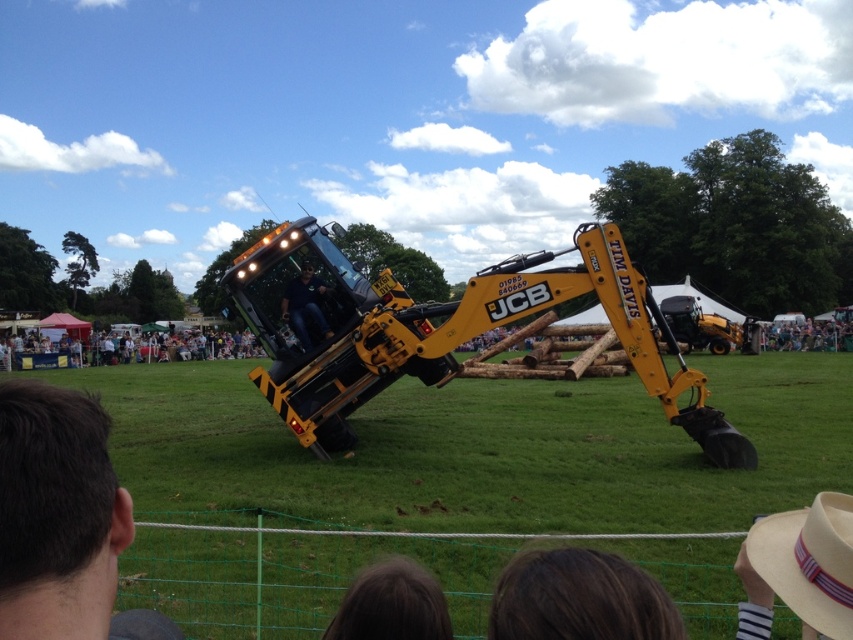
Question: Which point is closer to the camera?

Choices:
 (A) (625, 602)
 (B) (285, 244)
 (C) (817, 448)

Answer: (A)

Question: Which of the following is the closest to the observer?

Choices:
 (A) (338, 404)
 (B) (306, 284)
 (C) (590, 625)

Answer: (C)

Question: Which of the following is the farthest from the observer?

Choices:
 (A) green grass at center
 (B) dark brown hair at lower center

Answer: (A)

Question: Can you confirm if green grass at center is bigger than dark brown hair at lower center?

Choices:
 (A) no
 (B) yes

Answer: (B)

Question: Is green grass at center to the left of yellow metallic tractor at center from the viewer's perspective?

Choices:
 (A) no
 (B) yes

Answer: (A)

Question: Can you confirm if green grass at center is thinner than yellow metallic tractor at center?

Choices:
 (A) no
 (B) yes

Answer: (A)